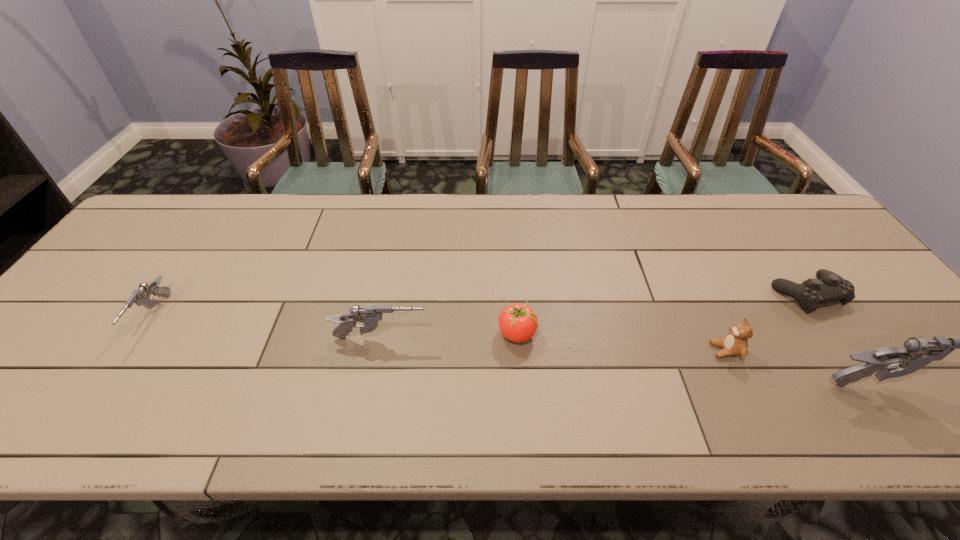
Identify the location of object that stands as the second closest to the second tallest gun. The height and width of the screenshot is (540, 960). (141, 296).

Find the location of a particular element. This screenshot has height=540, width=960. object that is the second closest to the leftmost object is located at coordinates (518, 322).

Locate an element on the screen. The height and width of the screenshot is (540, 960). the second closest gun to the second gun from right to left is located at coordinates (918, 352).

Identify the location of gun that stands as the closest to the third object from right to left. The height and width of the screenshot is (540, 960). (918, 352).